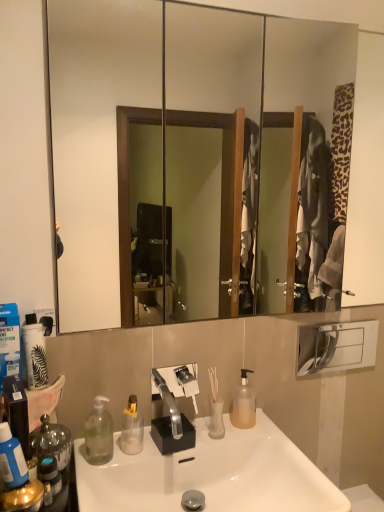
Question: From a real-world perspective, is clear plastic bottle at lower left, which appears as the third bottle when viewed from the right, positioned above or below translucent plastic pump bottle at center, the 1th bottle from the back?

Choices:
 (A) above
 (B) below

Answer: (B)

Question: Considering the positions of point (94, 451) and point (243, 415), is point (94, 451) closer or farther from the camera than point (243, 415)?

Choices:
 (A) closer
 (B) farther

Answer: (A)

Question: Estimate the real-world distances between objects in this image. Which object is farther from the clear glass vase at center?

Choices:
 (A) translucent plastic pump bottle at center, which is the 1th bottle from right to left
 (B) transparent plastic bottle at sink, placed as the 2th bottle when sorted from back to front
 (C) blue matte bottle at left, which is the 1th bottle from left to right
 (D) clear plastic bottle at lower left, which appears as the third bottle when viewed from the right
 (E) white matte toilet paper at lower left

Answer: (C)

Question: Based on their relative distances, which object is farther from the white glossy sink at center?

Choices:
 (A) translucent plastic pump bottle at center, which is the 1th bottle from right to left
 (B) blue matte bottle at left, which is the 1th bottle from left to right
 (C) clear glass vase at center
 (D) white matte toilet paper at lower left
 (E) clear plastic bottle at lower left, which is counted as the third bottle, starting from the back

Answer: (D)